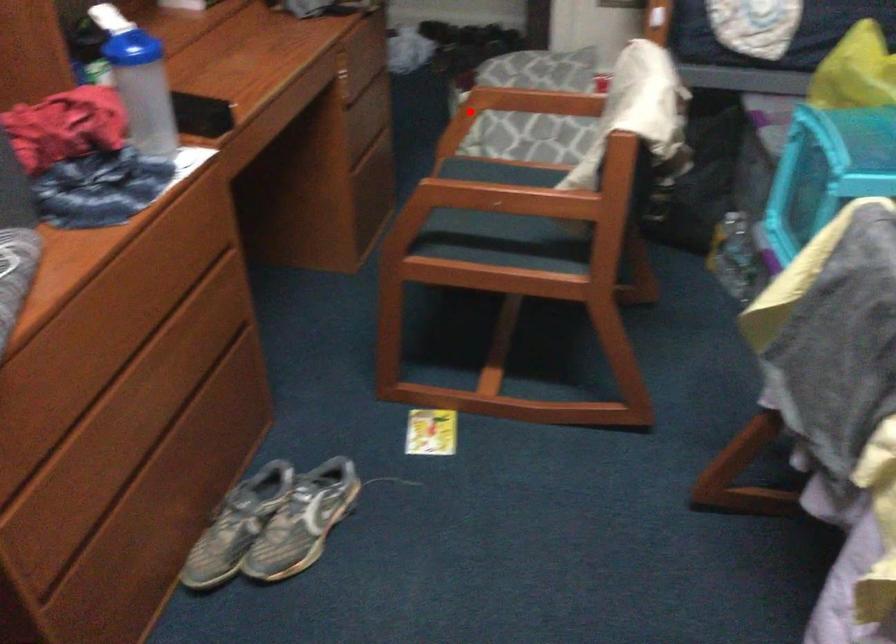
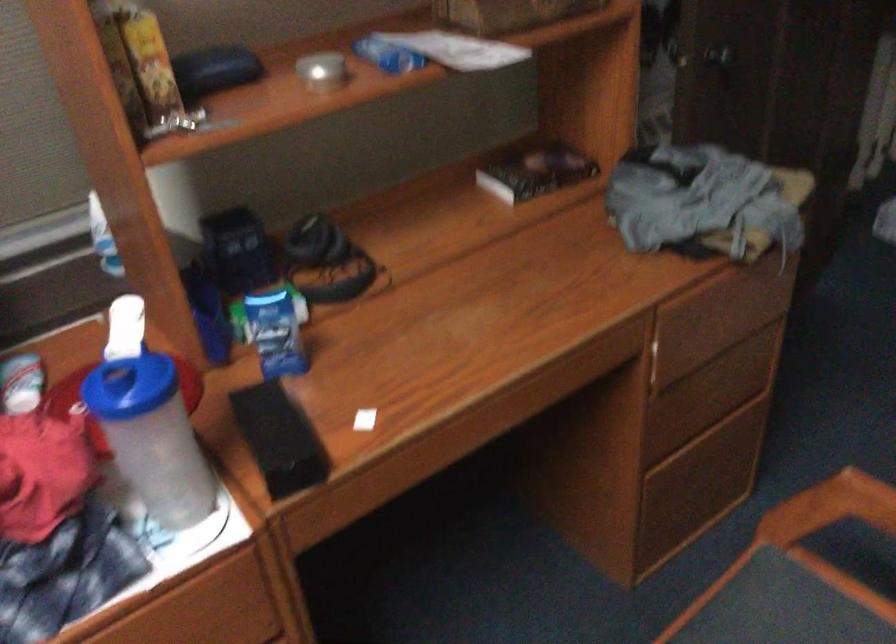
Where in the second image is the point corresponding to the highlighted location from the first image?

(830, 507)